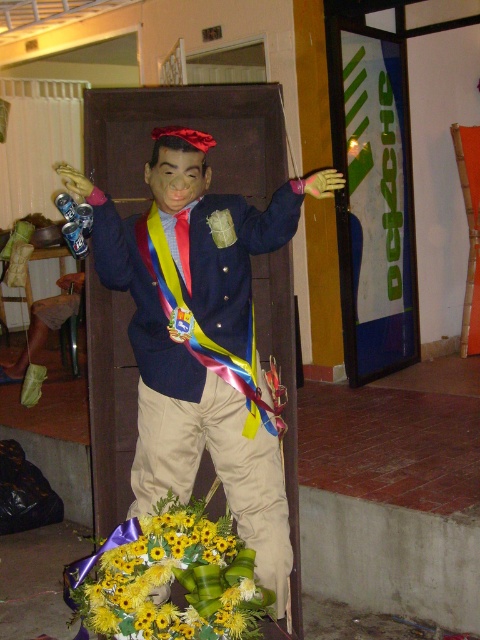
You are a visitor at a festival and see the matte plastic boy at center holding two Pepsi cans. There is also a bouquet of yellow artificial flowers at lower center. Which object is taller?

The matte plastic boy at center is taller than the yellow artificial flowers at lower center.

You are a florist arranging a display for a Venezuelan cultural event. You have a matte plastic boy at center and yellow artificial flowers at lower center. Which object should you place in a wider space to accommodate their size?

The matte plastic boy at center is wider than the yellow artificial flowers at lower center, so it should be placed in a wider space to accommodate its size.

You are standing in front of the figure holding Pepsi cans. There are two points marked on the ground in front of you. The first point is at coordinates point (237, 404) and the second is at point (216, 620). If you want to place a new flower bouquet between these two points, which point should the bouquet be closer to so it stays behind the second point?

The bouquet should be placed closer to point (216, 620) because point (237, 404) is behind point (216, 620), so placing it near the latter keeps it behind the second point.